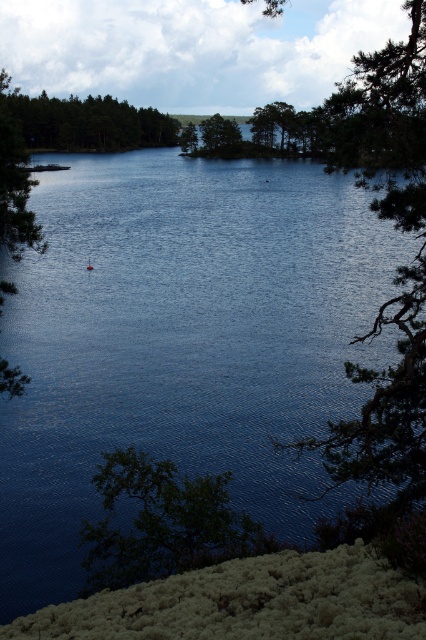
Question: Can you confirm if green leafy tree at lower left is thinner than green matte tree at center?

Choices:
 (A) no
 (B) yes

Answer: (B)

Question: From the image, what is the correct spatial relationship of green leafy tree at lower left in relation to green matte tree at center?

Choices:
 (A) above
 (B) below

Answer: (B)

Question: Observing the image, what is the correct spatial positioning of green matte tree at upper left in reference to green matte tree at center?

Choices:
 (A) right
 (B) left

Answer: (B)

Question: Which of the following is the farthest from the observer?

Choices:
 (A) pyautogui.click(x=22, y=115)
 (B) pyautogui.click(x=215, y=515)
 (C) pyautogui.click(x=230, y=124)

Answer: (A)

Question: Considering the real-world distances, which object is farthest from the green matte tree at center?

Choices:
 (A) green leafy tree at lower left
 (B) green matte tree at upper left

Answer: (A)

Question: Which point is closer to the camera?

Choices:
 (A) (135, 129)
 (B) (238, 132)
 (C) (155, 464)

Answer: (C)